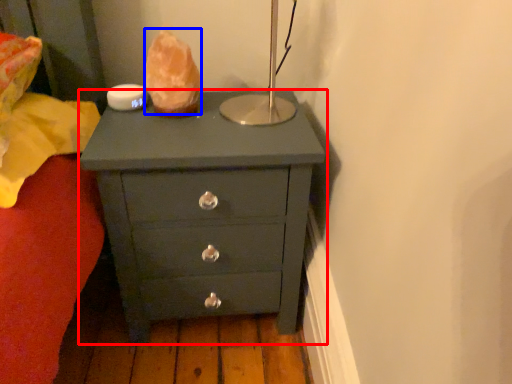
Question: Which of the following is the farthest to the observer, chest of drawers (highlighted by a red box) or food (highlighted by a blue box)?

Choices:
 (A) chest of drawers
 (B) food

Answer: (B)